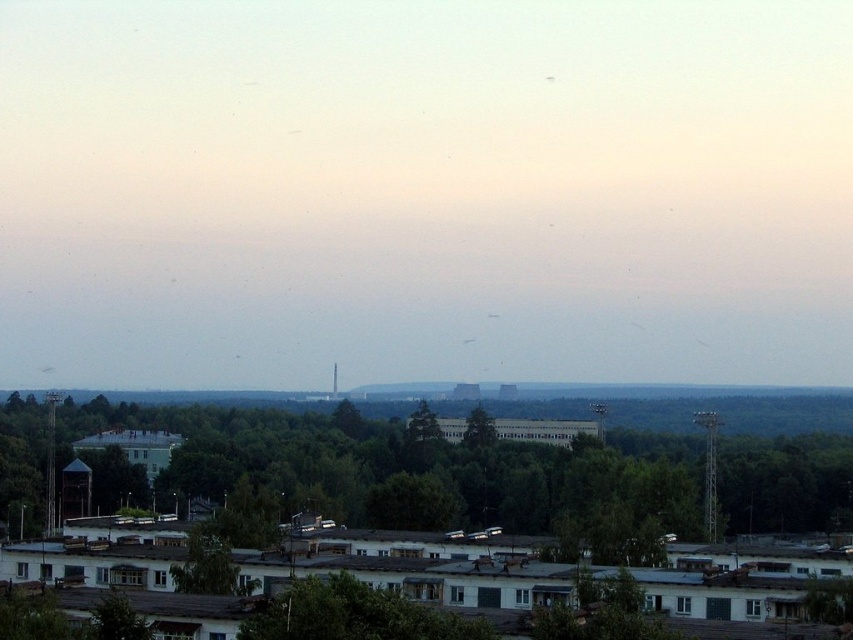
You are standing at the origin point of the image. Which direction should you move to reach the green leafy trees at center?

The green leafy trees at center are located at point 0.741 in the x direction and 0.533 in the y direction. Since you are at the origin, you should move towards the right and slightly upward to reach them.

You are standing at a point in the landscape scene described. You see two points marked in the image. If you were to walk towards the point at coordinates point (x=196, y=428) and point (x=469, y=412), which point would you reach first?

You would reach point (x=196, y=428) first because it is in front of point (x=469, y=412).

From the picture: You are a drone operator tasked with flying a drone between two green leafy trees at center. The drone has a maximum flight distance of 100 meters. Can the drone successfully fly between them without running out of battery?

The green leafy trees at center are 108.97 meters apart, which exceeds the drone maximum flight distance of 100 meters. Therefore, the drone cannot successfully fly between them without running out of battery.